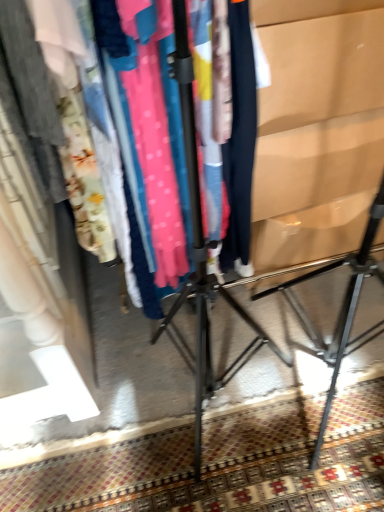
Image resolution: width=384 pixels, height=512 pixels. I want to click on matte black clothing rack at center, so click(x=30, y=99).

This screenshot has width=384, height=512. What do you see at coordinates (30, 99) in the screenshot?
I see `matte black clothing rack at center` at bounding box center [30, 99].

This screenshot has width=384, height=512. I want to click on carpeted floor at lower center, so click(222, 463).

What do you see at coordinates (222, 463) in the screenshot? Image resolution: width=384 pixels, height=512 pixels. I see `carpeted floor at lower center` at bounding box center [222, 463].

Describe the element at coordinates (340, 309) in the screenshot. I see `matte cardboard at right` at that location.

Locate an element on the screen. This screenshot has height=512, width=384. matte black clothing rack at center is located at coordinates (30, 99).

Considering the relative sizes of carpeted floor at lower center and matte black clothing rack at center in the image provided, is carpeted floor at lower center thinner than matte black clothing rack at center?

No.

Is carpeted floor at lower center bigger than matte black clothing rack at center?

Incorrect, carpeted floor at lower center is not larger than matte black clothing rack at center.

From a real-world perspective, who is located lower, carpeted floor at lower center or matte black clothing rack at center?

carpeted floor at lower center, from a real-world perspective.

Could you tell me if carpeted floor at lower center is facing matte black clothing rack at center?

No, carpeted floor at lower center is not facing towards matte black clothing rack at center.

Is matte black clothing rack at center bigger than carpeted floor at lower center?

Indeed, matte black clothing rack at center has a larger size compared to carpeted floor at lower center.

How distant is matte black clothing rack at center from carpeted floor at lower center?

35.21 inches.

Which of these two, matte black clothing rack at center or carpeted floor at lower center, stands taller?

With more height is matte black clothing rack at center.

Looking at this image, between matte black clothing rack at center and carpeted floor at lower center, which one has smaller width?

With smaller width is matte black clothing rack at center.

Is matte black clothing rack at center positioned beyond the bounds of matte cardboard at right?

matte black clothing rack at center lies outside matte cardboard at right's area.

Is matte black clothing rack at center at the left side of matte cardboard at right?

Indeed, matte black clothing rack at center is positioned on the left side of matte cardboard at right.

Considering the sizes of objects matte black clothing rack at center and matte cardboard at right in the image provided, who is taller, matte black clothing rack at center or matte cardboard at right?

matte cardboard at right.

Which object is further away from the camera, matte black clothing rack at center or matte cardboard at right?

Positioned behind is matte black clothing rack at center.

From a real-world perspective, which is physically above, carpeted floor at lower center or matte cardboard at right?

From a 3D spatial view, matte cardboard at right is above.

From the image's perspective, which is below, carpeted floor at lower center or matte cardboard at right?

carpeted floor at lower center, from the image's perspective.

Could you tell me if carpeted floor at lower center is facing matte cardboard at right?

No, carpeted floor at lower center is not oriented towards matte cardboard at right.

Is matte cardboard at right inside carpeted floor at lower center?

No.

Which of these two, matte cardboard at right or matte black clothing rack at center, stands taller?

matte cardboard at right.

From the image's perspective, relative to matte black clothing rack at center, is matte cardboard at right above or below?

Clearly, from the image's perspective, matte cardboard at right is below matte black clothing rack at center.

Can you confirm if matte cardboard at right is positioned to the left of matte black clothing rack at center?

In fact, matte cardboard at right is to the right of matte black clothing rack at center.

The width and height of the screenshot is (384, 512). I want to click on tripod that appears below the matte black clothing rack at center (from a real-world perspective), so (340, 309).

Locate an element on the screen. mat on the left of matte cardboard at right is located at coordinates (222, 463).

From the image's perspective, which one is positioned lower, matte cardboard at right or carpeted floor at lower center?

carpeted floor at lower center, from the image's perspective.

Is matte cardboard at right inside the boundaries of carpeted floor at lower center, or outside?

matte cardboard at right is located beyond the bounds of carpeted floor at lower center.

How many degrees apart are the facing directions of matte cardboard at right and carpeted floor at lower center?

The angle between the facing direction of matte cardboard at right and the facing direction of carpeted floor at lower center is 149 degrees.

Identify the location of closet in front of the carpeted floor at lower center. The width and height of the screenshot is (384, 512). (30, 99).

Locate an element on the screen. Image resolution: width=384 pixels, height=512 pixels. mat behind the matte black clothing rack at center is located at coordinates (222, 463).

Which object lies nearer to the anchor point matte black clothing rack at center, matte cardboard at right or carpeted floor at lower center?

carpeted floor at lower center is positioned closer to the anchor matte black clothing rack at center.

Looking at the image, which one is located further to matte cardboard at right, matte black clothing rack at center or carpeted floor at lower center?

matte black clothing rack at center.

Looking at the image, which one is located further to matte cardboard at right, carpeted floor at lower center or matte black clothing rack at center?

matte black clothing rack at center is positioned further to the anchor matte cardboard at right.

Considering their positions, is matte black clothing rack at center positioned further to carpeted floor at lower center than matte cardboard at right?

Among the two, matte black clothing rack at center is located further to carpeted floor at lower center.

Considering their positions, is matte cardboard at right positioned further to carpeted floor at lower center than matte black clothing rack at center?

Among the two, matte black clothing rack at center is located further to carpeted floor at lower center.

Looking at the image, which one is located further to matte black clothing rack at center, carpeted floor at lower center or matte cardboard at right?

matte cardboard at right.

This screenshot has height=512, width=384. I want to click on tripod that lies between matte black clothing rack at center and carpeted floor at lower center from top to bottom, so click(340, 309).